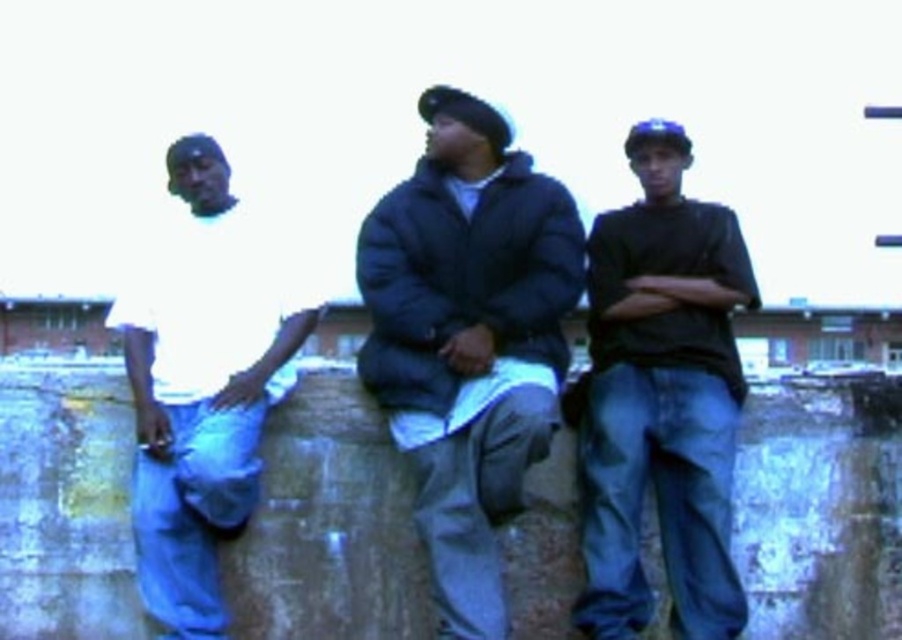
Based on the scene description, which object is wider? The dark blue puffy jacket at center or the matte black shirt at center?

The dark blue puffy jacket at center is wider than the matte black shirt at center according to the description.

You are organizing a clothing donation drive and need to determine if the dark blue puffy jacket at center and the white matte shirt at left can fit into a standard donation box that is 18 inches wide. Based on their widths, will both items fit side by side?

The dark blue puffy jacket at center is wider than the white matte shirt at left. Since the donation box is only 18 inches wide, and the jacket alone may already exceed that width, it is unlikely both items can fit side by side.

You are a photographer trying to capture a group photo of the matte black shirt at center and the white matte shirt at left. Based on their positions, which subject is positioned higher in the frame?

The matte black shirt at center is located above the white matte shirt at left, so it is positioned higher in the frame.